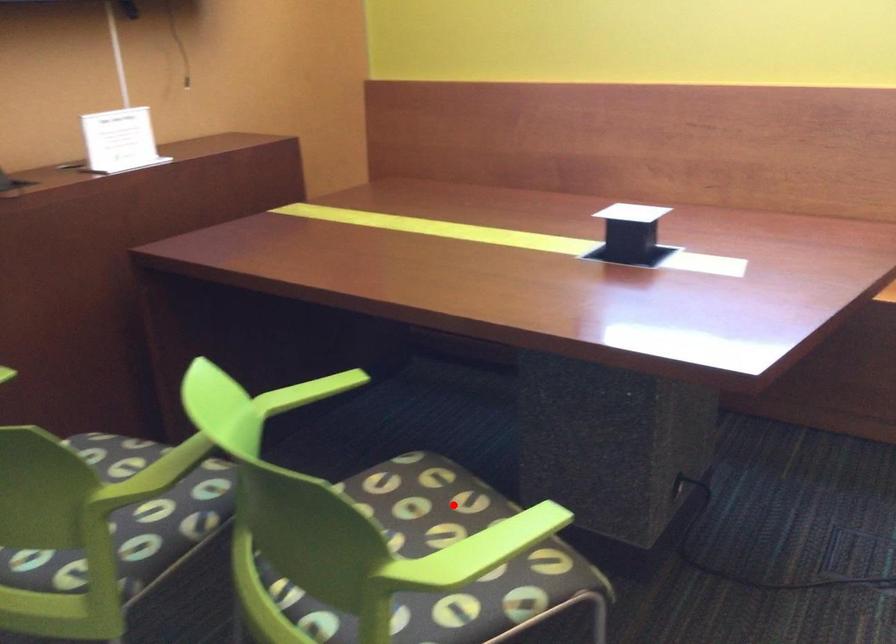
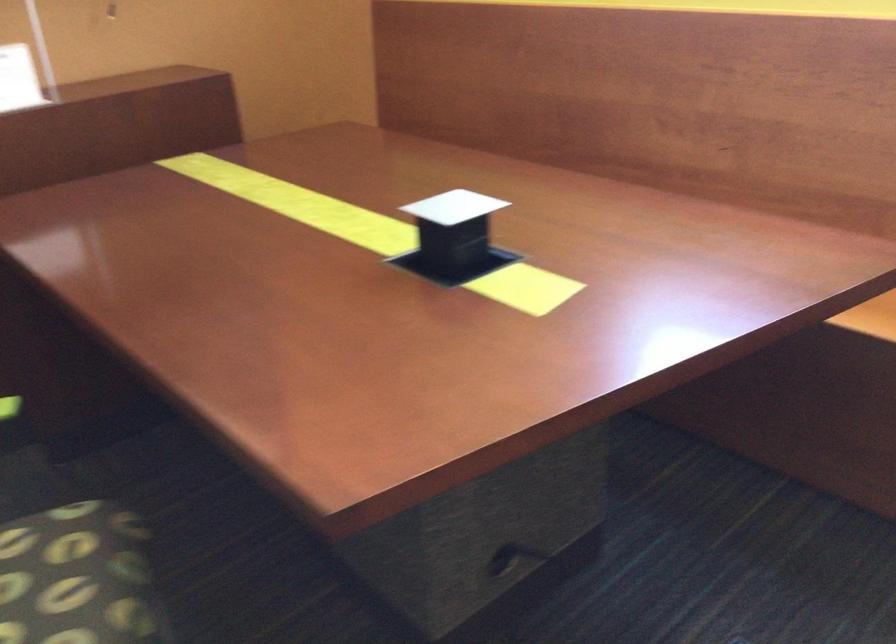
Locate, in the second image, the point that corresponds to the highlighted location in the first image.

(74, 576)